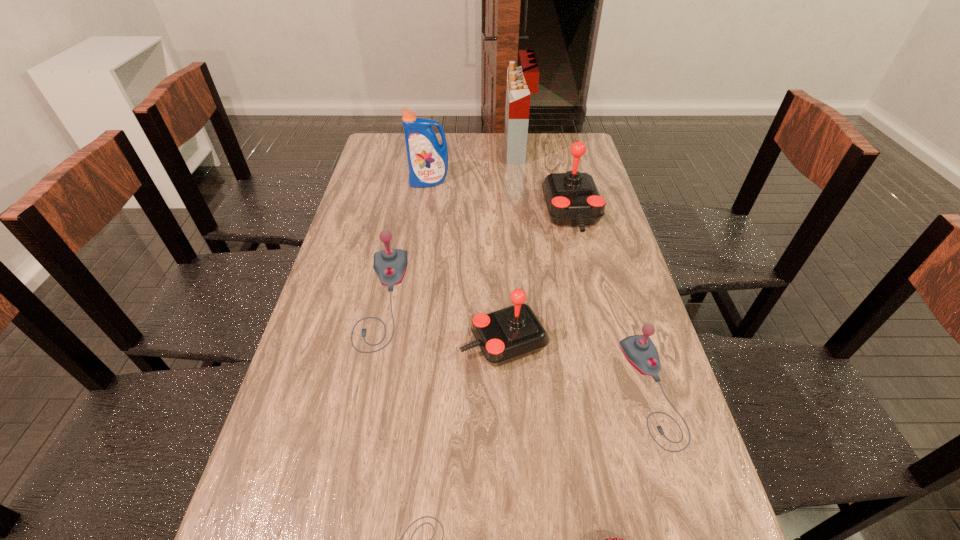
Image resolution: width=960 pixels, height=540 pixels. What are the coordinates of `object located in the far edge section of the desktop` in the screenshot? It's located at (522, 81).

Image resolution: width=960 pixels, height=540 pixels. Identify the location of object that is at the left edge. (390, 265).

I want to click on vacant space at the left edge of the desktop, so click(371, 281).

The width and height of the screenshot is (960, 540). Identify the location of free space at the right edge of the desktop. (628, 268).

I want to click on vacant space at the far right corner of the desktop, so click(x=549, y=142).

Identify the location of empty space that is in between the biggest gray joystick and the second tallest joystick. (443, 321).

Image resolution: width=960 pixels, height=540 pixels. I want to click on free space that is in between the cigarette case and the biggest gray joystick, so click(x=449, y=225).

Locate an element on the screen. The height and width of the screenshot is (540, 960). the closest object relative to the third joystick from left to right is located at coordinates (390, 265).

Select which object appears as the fourth closest to the farthest object. Please provide its 2D coordinates. Your answer should be formatted as a tuple, i.e. [(x, y)], where the tuple contains the x and y coordinates of a point satisfying the conditions above.

[(509, 334)]

Identify which joystick is the fourth nearest to the chocolate chocolate cake. Please provide its 2D coordinates. Your answer should be formatted as a tuple, i.e. [(x, y)], where the tuple contains the x and y coordinates of a point satisfying the conditions above.

[(390, 265)]